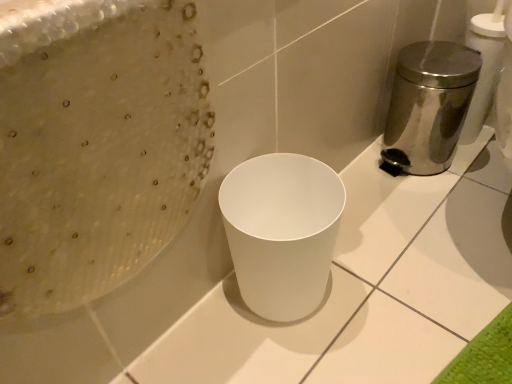
Identify the location of free space in front of white matte waste container at center. (300, 357).